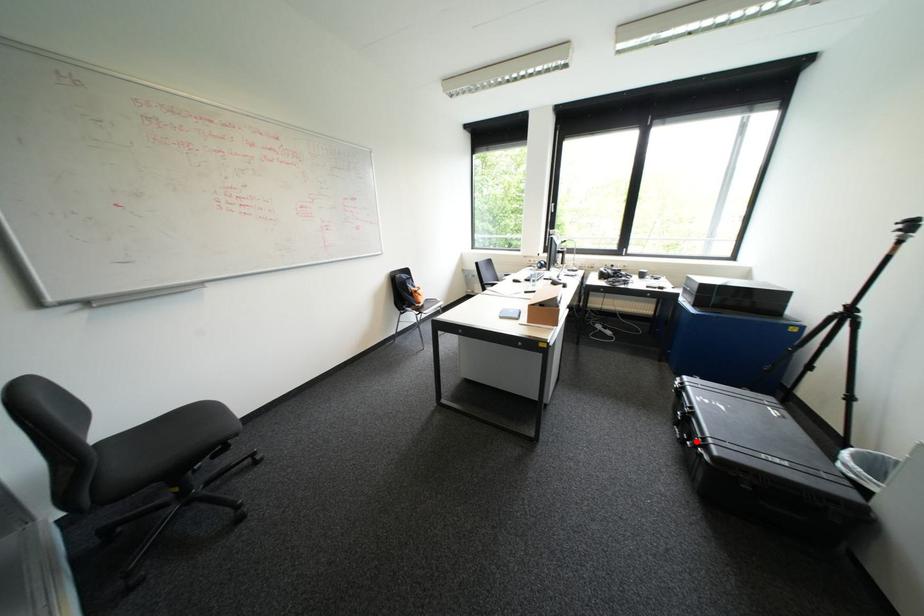
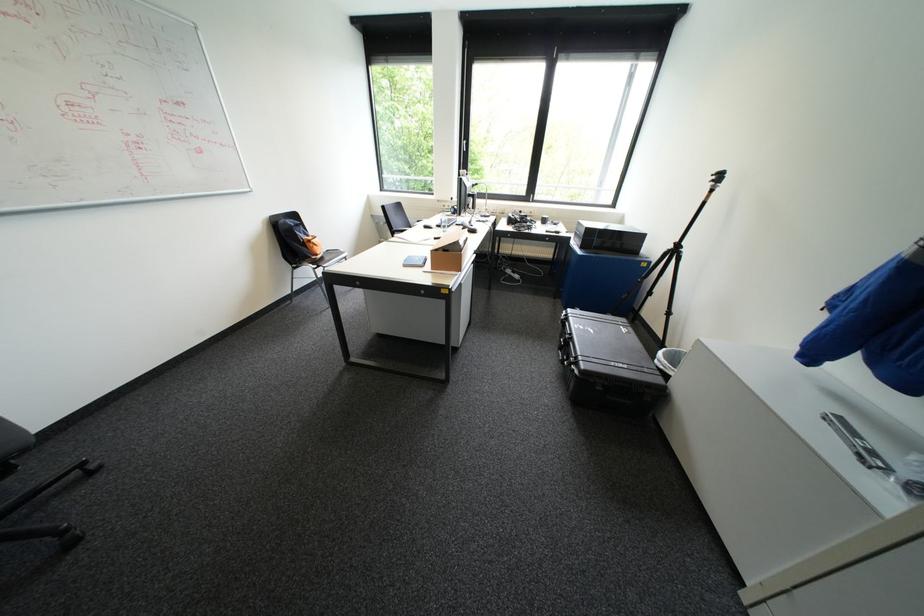
Where in the second image is the point corresponding to the highlighted location from the first image?

(574, 361)